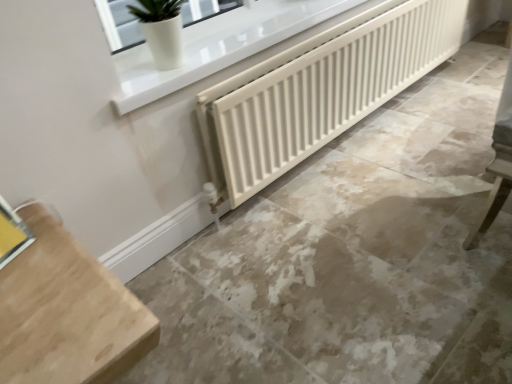
You are a GUI agent. You are given a task and a screenshot of the screen. Output one action in this format:
    pyautogui.click(x=<x>, y=<y>)
    Task: Click on the free point in front of yellow cardboard at lower left, which is counted as the first window, starting from the left
    
    Given the screenshot: What is the action you would take?
    pyautogui.click(x=19, y=297)